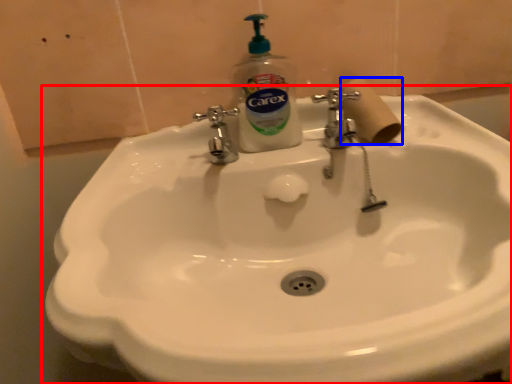
Question: Among these objects, which one is nearest to the camera, sink (highlighted by a red box) or toilet paper (highlighted by a blue box)?

Choices:
 (A) sink
 (B) toilet paper

Answer: (A)